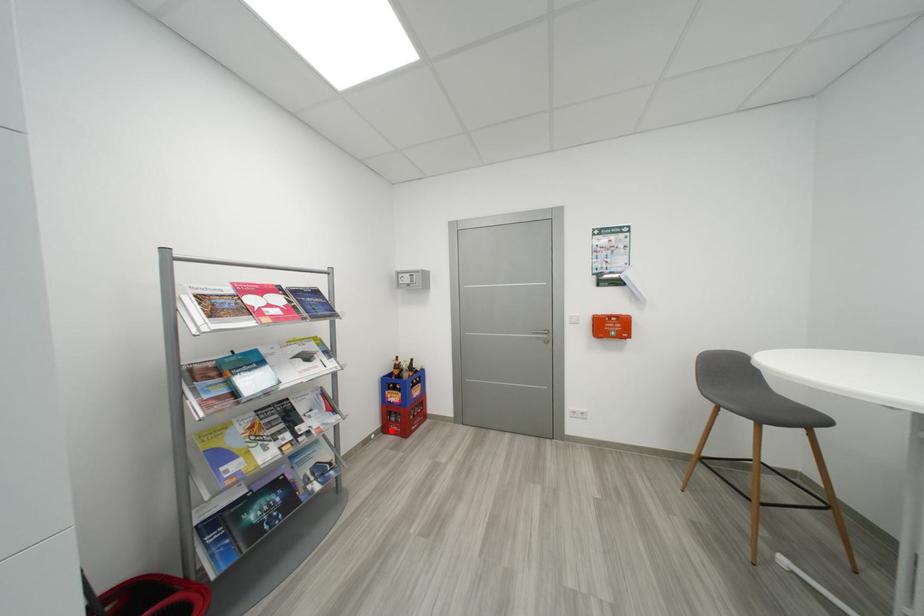
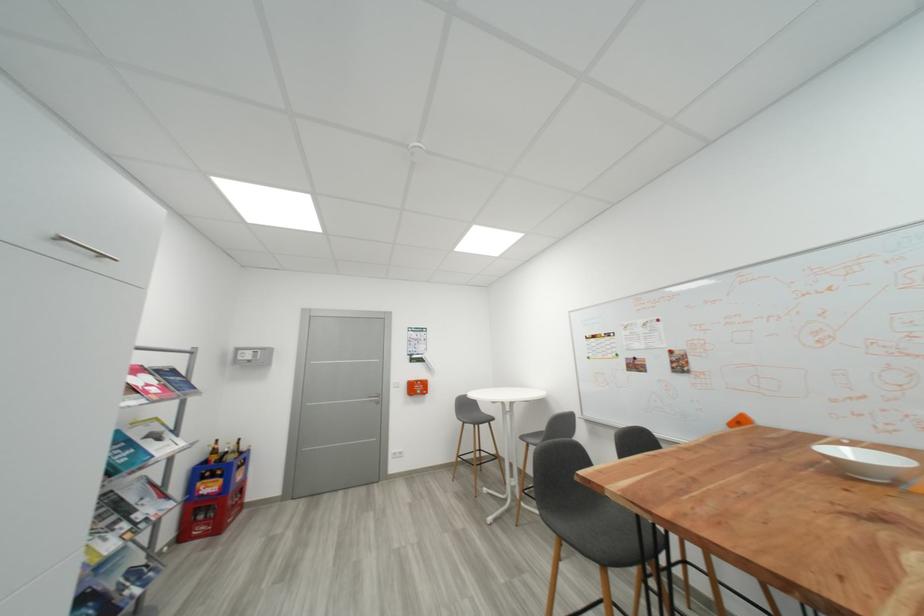
Question: I am providing you with two images of the same scene from different viewpoints. A red point is marked on the first image. Is the red point's position out of view in image 2?

Choices:
 (A) Yes
 (B) No

Answer: (B)